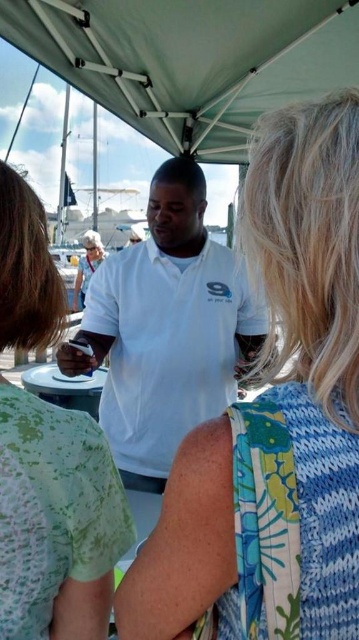
Question: Which of the following is the closest to the observer?

Choices:
 (A) floral fabric dress at center
 (B) green textured blouse at center
 (C) white matte shirt at center

Answer: (A)

Question: Estimate the real-world distances between objects in this image. Which object is closer to the white matte shirt at center?

Choices:
 (A) floral fabric dress at center
 (B) white fabric canopy at upper center

Answer: (B)

Question: Can you confirm if white fabric canopy at upper center is positioned to the left of green textured blouse at center?

Choices:
 (A) no
 (B) yes

Answer: (A)

Question: Which of the following is the farthest from the observer?

Choices:
 (A) floral fabric dress at center
 (B) white fabric canopy at upper center
 (C) white matte shirt at center
 (D) green textured blouse at center

Answer: (B)

Question: Observing the image, what is the correct spatial positioning of green textured blouse at center in reference to white matte shirt at center?

Choices:
 (A) above
 (B) below

Answer: (B)

Question: Is white fabric canopy at upper center to the right of white matte shirt at center from the viewer's perspective?

Choices:
 (A) yes
 (B) no

Answer: (A)